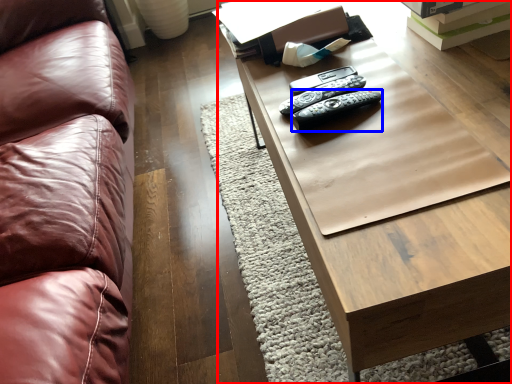
Question: Which object is further to the camera taking this photo, table (highlighted by a red box) or remote (highlighted by a blue box)?

Choices:
 (A) table
 (B) remote

Answer: (B)